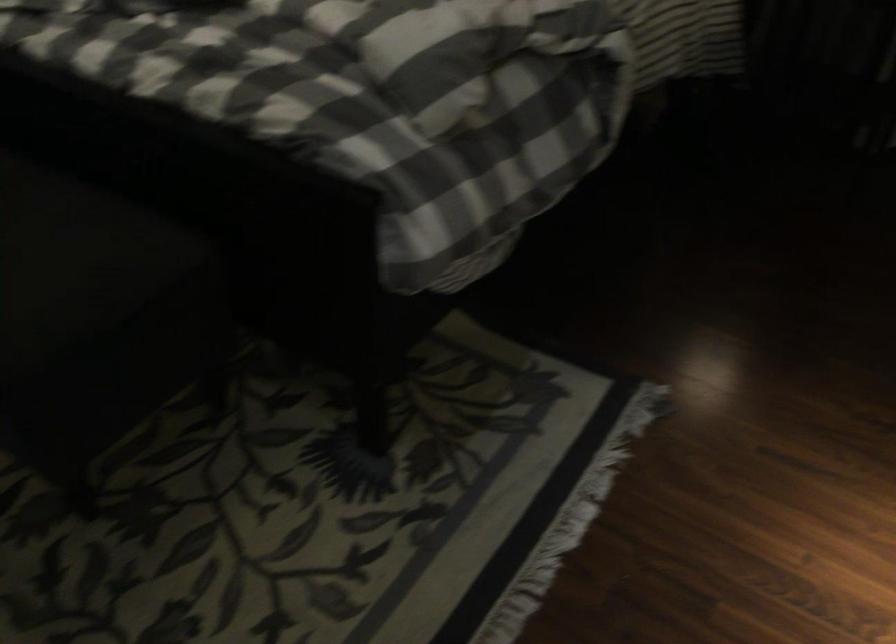
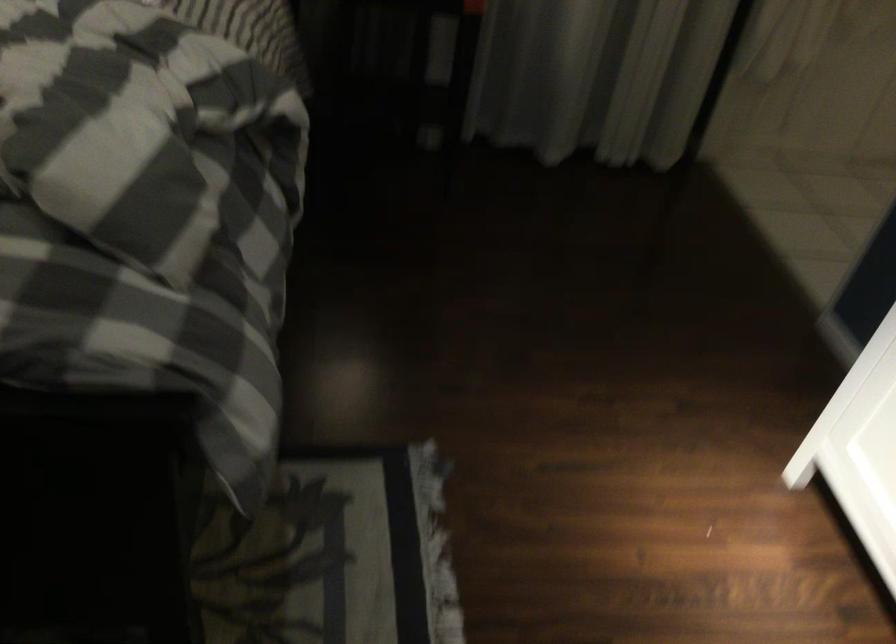
Question: The camera is either moving clockwise (left) or counter-clockwise (right) around the object. The first image is from the beginning of the video and the second image is from the end. Is the camera moving left or right when shooting the video?

Choices:
 (A) Left
 (B) Right

Answer: (A)